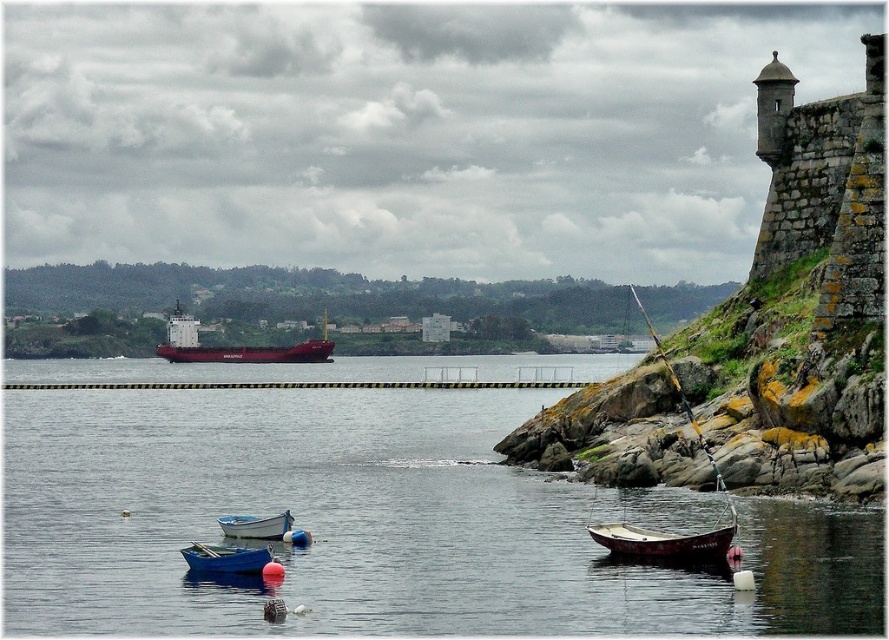
From the picture: Is wooden boat at lower right smaller than red matte cargo ship at center?

Yes.

Who is shorter, wooden boat at lower right or red matte cargo ship at center?

Standing shorter between the two is wooden boat at lower right.

Which is in front, point (607, 545) or point (273, 356)?

Positioned in front is point (607, 545).

Find the location of a particular element. wooden boat at lower right is located at coordinates (667, 541).

Is blue matte boat at lower left to the right of blue wooden boat at lower left from the viewer's perspective?

Correct, you'll find blue matte boat at lower left to the right of blue wooden boat at lower left.

Can you confirm if blue matte boat at lower left is positioned below blue wooden boat at lower left?

Indeed, blue matte boat at lower left is positioned under blue wooden boat at lower left.

At what (x,y) coordinates should I click in order to perform the action: click on blue matte boat at lower left. Please return your answer as a coordinate pair (x, y). The image size is (889, 640). Looking at the image, I should click on (225, 557).

Find the location of a particular element. blue matte boat at lower left is located at coordinates (225, 557).

Does red matte cargo ship at center have a lesser height compared to blue matte boat at lower left?

No.

Who is higher up, red matte cargo ship at center or blue matte boat at lower left?

red matte cargo ship at center

Which is behind, point (178, 356) or point (212, 545)?

The point (178, 356) is more distant.

Locate an element on the screen. This screenshot has height=640, width=889. red matte cargo ship at center is located at coordinates (235, 346).